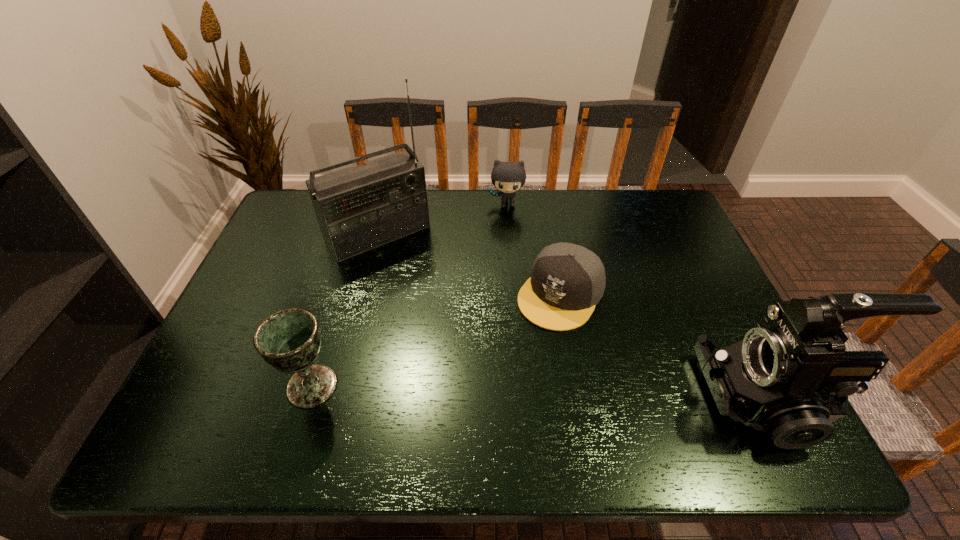
Where is `object that stands as the second closest to the shortest object`? The width and height of the screenshot is (960, 540). object that stands as the second closest to the shortest object is located at coordinates (508, 177).

Where is `vacant area that satisfies the following two spatial constraints: 1. on the back side of the cap; 2. on the left side of the chalice`? This screenshot has width=960, height=540. vacant area that satisfies the following two spatial constraints: 1. on the back side of the cap; 2. on the left side of the chalice is located at coordinates pyautogui.click(x=340, y=294).

This screenshot has height=540, width=960. Find the location of `vacant region that satisfies the following two spatial constraints: 1. on the front side of the rightmost object; 2. on the lens mount of the cap`. vacant region that satisfies the following two spatial constraints: 1. on the front side of the rightmost object; 2. on the lens mount of the cap is located at coordinates (579, 398).